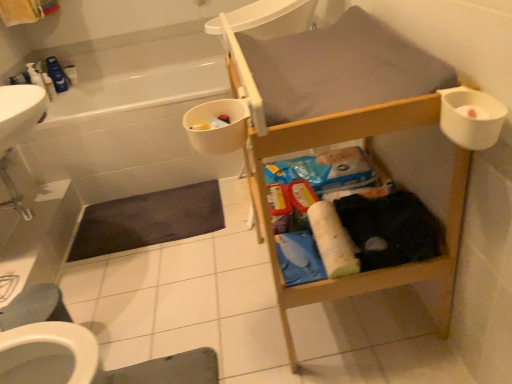
The image size is (512, 384). What are the coordinates of `free space to the back side of white plastic bidet at lower left` in the screenshot? It's located at (92, 301).